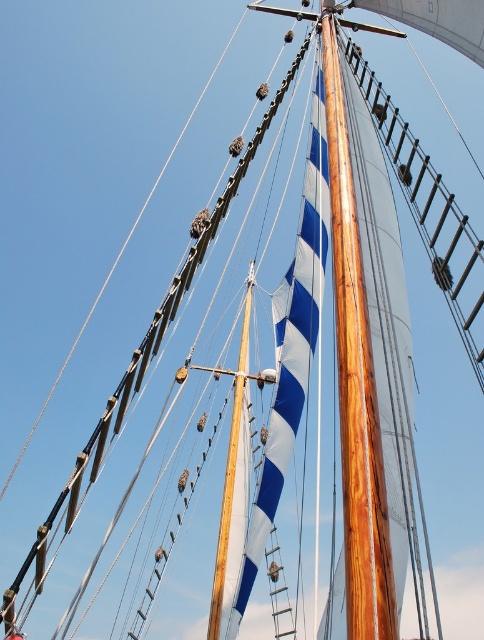
Question: From the image, what is the correct spatial relationship of shiny polished wood mast at center in relation to wooden mast at center?

Choices:
 (A) below
 (B) above

Answer: (B)

Question: Where is shiny polished wood mast at center located in relation to wooden mast at center in the image?

Choices:
 (A) left
 (B) right

Answer: (B)

Question: Which object is closer to the camera taking this photo?

Choices:
 (A) shiny polished wood mast at center
 (B) wooden mast at center

Answer: (A)

Question: Is shiny polished wood mast at center thinner than wooden mast at center?

Choices:
 (A) yes
 (B) no

Answer: (A)